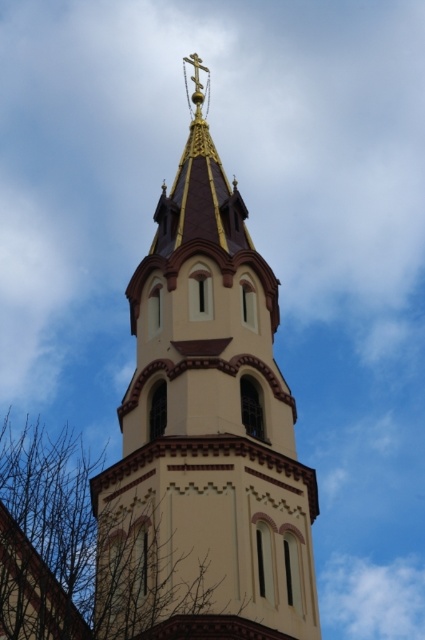
You are standing in front of the church tower and want to take a photo of the matte gold spire at center without the brown leafless branches at lower left blocking the view. Is it possible to position yourself in such a way that the branches are not visible in the frame?

The brown leafless branches at lower left are behind the matte gold spire at center, so positioning yourself so the spire is between you and the branches would hide them from view, making it possible to take a clear photo of the matte gold spire at center without the branches obstructing the view.

In the scene shown: You are standing in front of the church tower and want to locate the matte gold spire at center. According to the coordinates provided, where should you look to find it?

The matte gold spire at center is located at point (204, 435), so you should look towards the upper portion of the tower to find it.